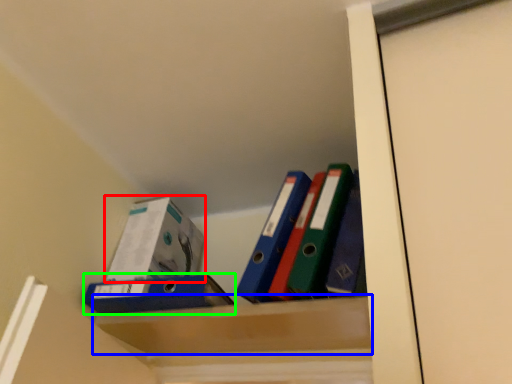
Question: Which object is the farthest from box (highlighted by a red box)? Choose among these: cabinet (highlighted by a blue box) or paperback book (highlighted by a green box).

Choices:
 (A) cabinet
 (B) paperback book

Answer: (A)